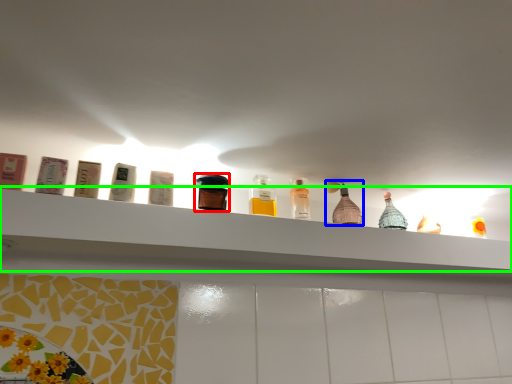
Question: Considering the real-world distances, which object is farthest from bottle (highlighted by a red box)? bottle (highlighted by a blue box) or shelf (highlighted by a green box)?

Choices:
 (A) bottle
 (B) shelf

Answer: (A)